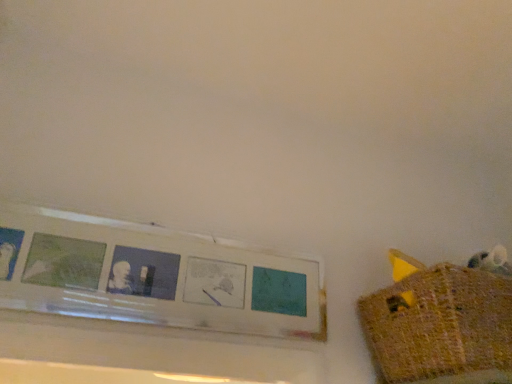
Question: From the image's perspective, is white matte picture frame at upper left on top of knitted yellow basket at right?

Choices:
 (A) yes
 (B) no

Answer: (A)

Question: Is white matte picture frame at upper left aimed at knitted yellow basket at right?

Choices:
 (A) no
 (B) yes

Answer: (A)

Question: From a real-world perspective, is white matte picture frame at upper left located beneath knitted yellow basket at right?

Choices:
 (A) no
 (B) yes

Answer: (A)

Question: Is white matte picture frame at upper left with knitted yellow basket at right?

Choices:
 (A) yes
 (B) no

Answer: (B)

Question: Considering the relative positions of white matte picture frame at upper left and knitted yellow basket at right in the image provided, is white matte picture frame at upper left to the left of knitted yellow basket at right from the viewer's perspective?

Choices:
 (A) yes
 (B) no

Answer: (A)

Question: Considering the relative sizes of white matte picture frame at upper left and knitted yellow basket at right in the image provided, is white matte picture frame at upper left thinner than knitted yellow basket at right?

Choices:
 (A) no
 (B) yes

Answer: (B)

Question: Is knitted yellow basket at right taller than white matte picture frame at upper left?

Choices:
 (A) yes
 (B) no

Answer: (B)

Question: Is knitted yellow basket at right at the left side of white matte picture frame at upper left?

Choices:
 (A) yes
 (B) no

Answer: (B)

Question: Does knitted yellow basket at right have a lesser height compared to white matte picture frame at upper left?

Choices:
 (A) no
 (B) yes

Answer: (B)

Question: Could you tell me if knitted yellow basket at right is facing white matte picture frame at upper left?

Choices:
 (A) yes
 (B) no

Answer: (B)

Question: Is knitted yellow basket at right bigger than white matte picture frame at upper left?

Choices:
 (A) yes
 (B) no

Answer: (A)

Question: Considering the relative positions of knitted yellow basket at right and white matte picture frame at upper left in the image provided, is knitted yellow basket at right in front of white matte picture frame at upper left?

Choices:
 (A) yes
 (B) no

Answer: (A)

Question: From a real-world perspective, is knitted yellow basket at right positioned above or below white matte picture frame at upper left?

Choices:
 (A) below
 (B) above

Answer: (A)